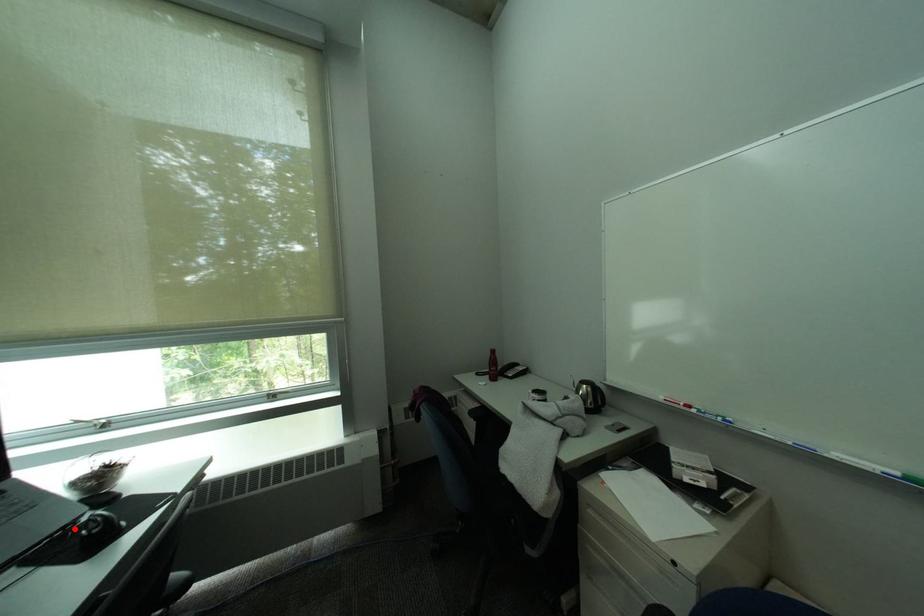
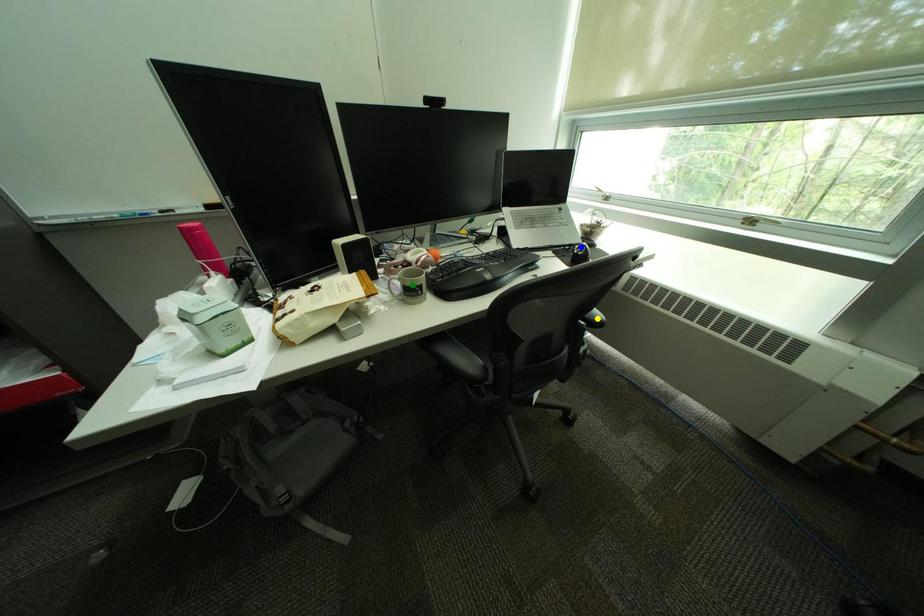
Question: I am providing you with two images of the same scene from different viewpoints. A red point is marked on the first image. You are given multiple points on the second image. Which spot in image 2 lines up with the point in image 1?

Choices:
 (A) yellow point
 (B) green point
 (C) blue point

Answer: (C)